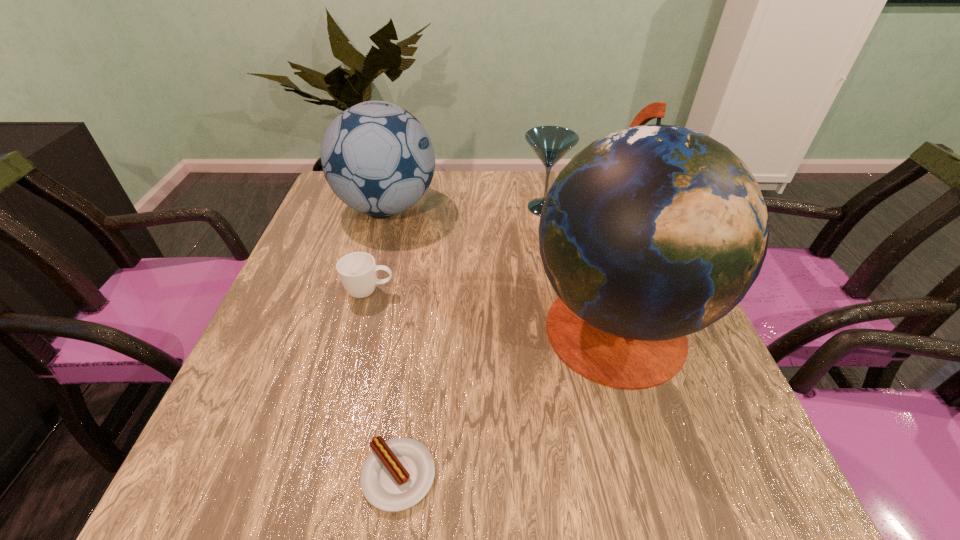
Where is `vacant space that is in between the third tallest object and the second tallest object`? The image size is (960, 540). vacant space that is in between the third tallest object and the second tallest object is located at coordinates coord(466,208).

Identify the location of vacant space that's between the nearest object and the fourth tallest object. (384, 383).

Where is `free space between the fourth shortest object and the martini`? This screenshot has width=960, height=540. free space between the fourth shortest object and the martini is located at coordinates (466, 208).

The image size is (960, 540). What are the coordinates of `free space between the third shortest object and the cup` in the screenshot? It's located at (457, 250).

Locate an element on the screen. Image resolution: width=960 pixels, height=540 pixels. free space between the third shortest object and the nearest object is located at coordinates (471, 342).

At what (x,y) coordinates should I click in order to perform the action: click on object identified as the second closest to the tallest object. Please return your answer as a coordinate pair (x, y). Looking at the image, I should click on (550, 143).

Locate which object is the second closest to the tallest object. Please provide its 2D coordinates. Your answer should be formatted as a tuple, i.e. [(x, y)], where the tuple contains the x and y coordinates of a point satisfying the conditions above.

[(550, 143)]

Identify the location of vacant area in the image that satisfies the following two spatial constraints: 1. on the side with brand of the soccer ball; 2. on the left side of the martini. (387, 208).

The height and width of the screenshot is (540, 960). Find the location of `free spot that satisfies the following two spatial constraints: 1. on the side with brand of the nearest object; 2. on the right side of the second tallest object`. free spot that satisfies the following two spatial constraints: 1. on the side with brand of the nearest object; 2. on the right side of the second tallest object is located at coordinates (311, 476).

Where is `free spot that satisfies the following two spatial constraints: 1. with the handle on the side of the cup; 2. on the right side of the nearest object`? Image resolution: width=960 pixels, height=540 pixels. free spot that satisfies the following two spatial constraints: 1. with the handle on the side of the cup; 2. on the right side of the nearest object is located at coordinates (321, 476).